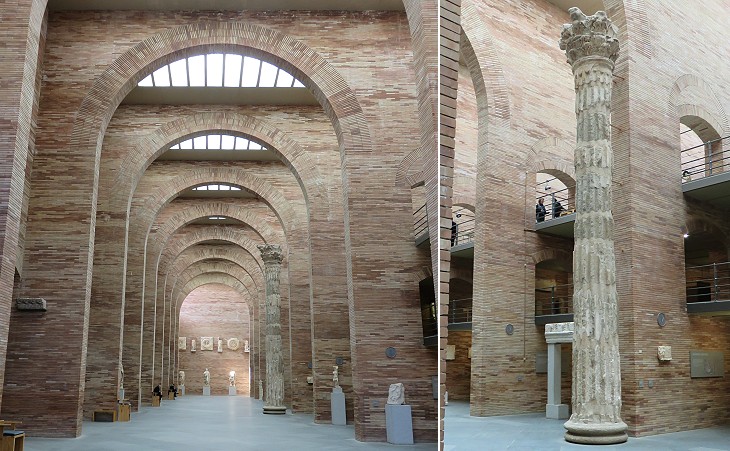
Locate an element on the screen. The image size is (730, 451). concrete floor is located at coordinates (506, 440), (231, 438).